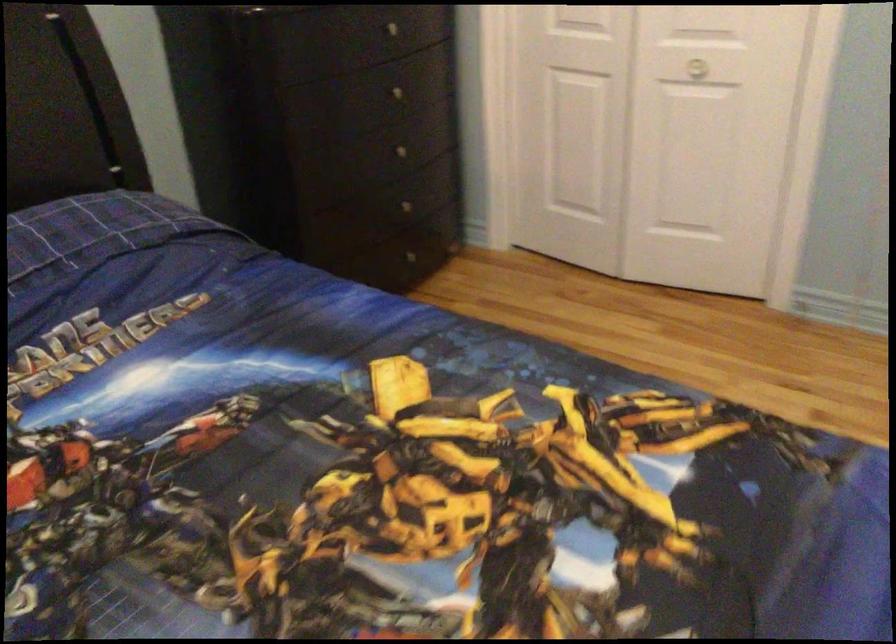
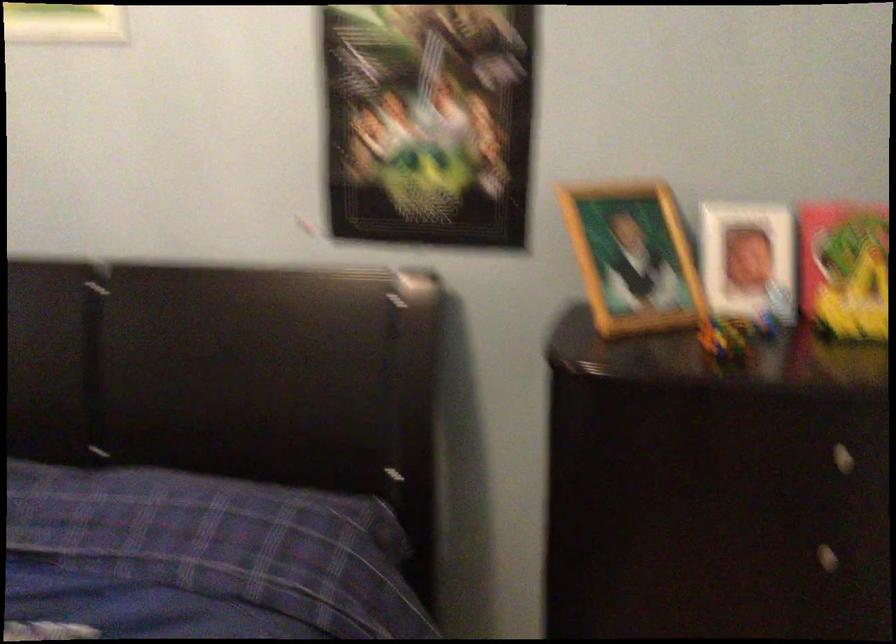
Find the pixel in the second image that matches (x=391, y=100) in the first image.

(807, 554)